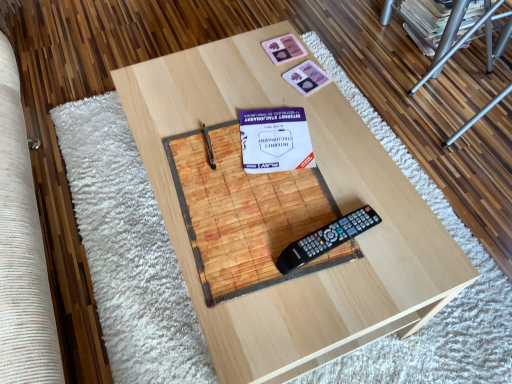
Measure the distance between point (433, 8) and camera.

Point (433, 8) and camera are 1.71 meters apart from each other.

Where is `white paper at center`? The image size is (512, 384). white paper at center is located at coordinates (275, 140).

Locate an element on the screen. wooden table at center is located at coordinates (333, 196).

Locate an element on the screen. black plastic remote control at center is located at coordinates (326, 239).

You are a GUI agent. You are given a task and a screenshot of the screen. Output one action in this format:
    pyautogui.click(x=<x>, y=<y>)
    Task: Click on the pink matte coaster at upper center, placed as the 2th square when sorted from bottom to top
    
    Given the screenshot: What is the action you would take?
    pyautogui.click(x=284, y=48)

Is white paper at center far from black plastic remote control at center?

white paper at center is actually quite close to black plastic remote control at center.

From the picture: From a real-world perspective, is white paper at center physically above black plastic remote control at center?

No, from a real-world perspective, white paper at center is not over black plastic remote control at center

You are a GUI agent. You are given a task and a screenshot of the screen. Output one action in this format:
    pyautogui.click(x=<x>, y=<y>)
    Task: Click on the equipment above the white paper at center (from a real-world perspective)
    The width and height of the screenshot is (512, 384).
    Given the screenshot: What is the action you would take?
    pyautogui.click(x=326, y=239)

Is white paper at center aimed at black plastic remote control at center?

No, white paper at center is not aimed at black plastic remote control at center.

Is matte cardboard magazine at upper right touching wooden table at center?

matte cardboard magazine at upper right is not next to wooden table at center, and they're not touching.

Is matte cardboard magazine at upper right oriented away from wooden table at center?

No.

Does matte cardboard magazine at upper right appear on the right side of wooden table at center?

Correct, you'll find matte cardboard magazine at upper right to the right of wooden table at center.

Considering the positions of points (327, 248) and (432, 24), is point (327, 248) closer to camera compared to point (432, 24)?

Yes.

This screenshot has width=512, height=384. Identify the location of magazine lying above the black plastic remote control at center (from the image's perspective). (426, 22).

Is black plastic remote control at center taller or shorter than matte cardboard magazine at upper right?

black plastic remote control at center is shorter than matte cardboard magazine at upper right.

From a real-world perspective, is black plastic remote control at center located higher than matte cardboard magazine at upper right?

Yes, from a real-world perspective, black plastic remote control at center is on top of matte cardboard magazine at upper right.

From the image's perspective, which is above, pink matte playing card at upper center, which ranks as the 2th square in top-to-bottom order, or white paper at center?

pink matte playing card at upper center, which ranks as the 2th square in top-to-bottom order.

Is pink matte playing card at upper center, which ranks as the 2th square in top-to-bottom order, surrounding white paper at center?

No, pink matte playing card at upper center, which ranks as the 2th square in top-to-bottom order, does not contain white paper at center.

Which of these two, pink matte playing card at upper center, which ranks as the 2th square in top-to-bottom order, or white paper at center, is thinner?

pink matte playing card at upper center, which ranks as the 2th square in top-to-bottom order.

Which object is further away from the camera, pink matte playing card at upper center, which ranks as the 2th square in top-to-bottom order, or white paper at center?

Positioned behind is pink matte playing card at upper center, which ranks as the 2th square in top-to-bottom order.

Does point (314, 231) come behind point (310, 76)?

That is False.

Can you confirm if black plastic remote control at center is smaller than pink matte playing card at upper center, acting as the 1th square starting from the bottom?

No.

Locate an element on the screen. This screenshot has width=512, height=384. square that is the 1st one when counting upward from the black plastic remote control at center (from the image's perspective) is located at coordinates (306, 77).

Can you tell me how much black plastic remote control at center and pink matte playing card at upper center, acting as the 1th square starting from the bottom, differ in facing direction?

The angular difference between black plastic remote control at center and pink matte playing card at upper center, acting as the 1th square starting from the bottom, is 5.56 degrees.

Based on the photo, would you say pink matte playing card at upper center, acting as the 1th square starting from the bottom, is outside wooden table at center?

No, pink matte playing card at upper center, acting as the 1th square starting from the bottom, is inside wooden table at center's boundary.

Is the position of pink matte playing card at upper center, acting as the 1th square starting from the bottom, less distant than that of wooden table at center?

No, the depth of pink matte playing card at upper center, acting as the 1th square starting from the bottom, is greater than that of wooden table at center.

Considering the relative positions of pink matte playing card at upper center, acting as the 1th square starting from the bottom, and wooden table at center in the image provided, is pink matte playing card at upper center, acting as the 1th square starting from the bottom, to the right of wooden table at center from the viewer's perspective?

Correct, you'll find pink matte playing card at upper center, acting as the 1th square starting from the bottom, to the right of wooden table at center.

Who is bigger, pink matte playing card at upper center, which ranks as the 2th square in top-to-bottom order, or wooden table at center?

With larger size is wooden table at center.

Does pink matte coaster at upper center, arranged as the 1th square when viewed from the top, appear on the left side of metallic silver ladder at upper right?

Correct, you'll find pink matte coaster at upper center, arranged as the 1th square when viewed from the top, to the left of metallic silver ladder at upper right.

Looking at this image, how many degrees apart are the facing directions of pink matte coaster at upper center, arranged as the 1th square when viewed from the top, and metallic silver ladder at upper right?

The angular difference between pink matte coaster at upper center, arranged as the 1th square when viewed from the top, and metallic silver ladder at upper right is 2.34 degrees.

From the image's perspective, which one is positioned lower, pink matte coaster at upper center, placed as the 2th square when sorted from bottom to top, or metallic silver ladder at upper right?

From the image's view, pink matte coaster at upper center, placed as the 2th square when sorted from bottom to top, is below.

Are pink matte coaster at upper center, placed as the 2th square when sorted from bottom to top, and metallic silver ladder at upper right located far from each other?

pink matte coaster at upper center, placed as the 2th square when sorted from bottom to top, is near metallic silver ladder at upper right, not far away.

This screenshot has width=512, height=384. In order to click on paperback book above the black plastic remote control at center (from the image's perspective) in this screenshot , I will do `click(275, 140)`.

In order to click on magazine on the right side of wooden table at center in this screenshot , I will do coord(426,22).

Which object lies further to the anchor point wooden table at center, pink matte playing card at upper center, acting as the 1th square starting from the bottom, or metallic silver ladder at upper right?

metallic silver ladder at upper right is further to wooden table at center.

Which object lies further to the anchor point black plastic remote control at center, metallic silver ladder at upper right or pink matte coaster at upper center, placed as the 2th square when sorted from bottom to top?

metallic silver ladder at upper right.

Considering their positions, is wooden table at center positioned closer to matte cardboard magazine at upper right than black plastic remote control at center?

wooden table at center is closer to matte cardboard magazine at upper right.

Estimate the real-world distances between objects in this image. Which object is further from wooden table at center, pink matte coaster at upper center, placed as the 2th square when sorted from bottom to top, or pink matte playing card at upper center, which ranks as the 2th square in top-to-bottom order?

pink matte coaster at upper center, placed as the 2th square when sorted from bottom to top, lies further to wooden table at center than the other object.

Looking at the image, which one is located further to matte cardboard magazine at upper right, metallic silver ladder at upper right or wooden table at center?

wooden table at center is positioned further to the anchor matte cardboard magazine at upper right.

Which object lies nearer to the anchor point white paper at center, wooden table at center or matte cardboard magazine at upper right?

The object closer to white paper at center is wooden table at center.

Looking at this image, which object lies nearer to the anchor point pink matte playing card at upper center, acting as the 1th square starting from the bottom, metallic silver ladder at upper right or pink matte coaster at upper center, arranged as the 1th square when viewed from the top?

Based on the image, pink matte coaster at upper center, arranged as the 1th square when viewed from the top, appears to be nearer to pink matte playing card at upper center, acting as the 1th square starting from the bottom.

Based on their spatial positions, is matte cardboard magazine at upper right or pink matte coaster at upper center, placed as the 2th square when sorted from bottom to top, further from wooden table at center?

matte cardboard magazine at upper right is further to wooden table at center.

Where is `paperback book that lies between pink matte playing card at upper center, which ranks as the 2th square in top-to-bottom order, and black plastic remote control at center from top to bottom`? The height and width of the screenshot is (384, 512). paperback book that lies between pink matte playing card at upper center, which ranks as the 2th square in top-to-bottom order, and black plastic remote control at center from top to bottom is located at coordinates (275, 140).

Find the location of `paperback book between pink matte coaster at upper center, placed as the 2th square when sorted from bottom to top, and black plastic remote control at center vertically`. paperback book between pink matte coaster at upper center, placed as the 2th square when sorted from bottom to top, and black plastic remote control at center vertically is located at coordinates (275, 140).

The width and height of the screenshot is (512, 384). In order to click on table between pink matte playing card at upper center, acting as the 1th square starting from the bottom, and black plastic remote control at center from top to bottom in this screenshot , I will do `click(333, 196)`.

At what (x,y) coordinates should I click in order to perform the action: click on paperback book between matte cardboard magazine at upper right and black plastic remote control at center from top to bottom. Please return your answer as a coordinate pair (x, y). Looking at the image, I should click on (275, 140).